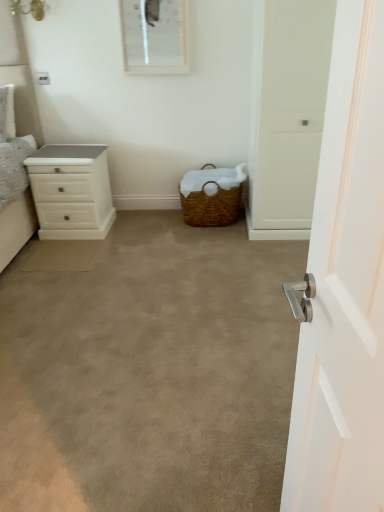
Find the location of `vacant space to the right of white glossy chest of drawers at left`. vacant space to the right of white glossy chest of drawers at left is located at coordinates (131, 225).